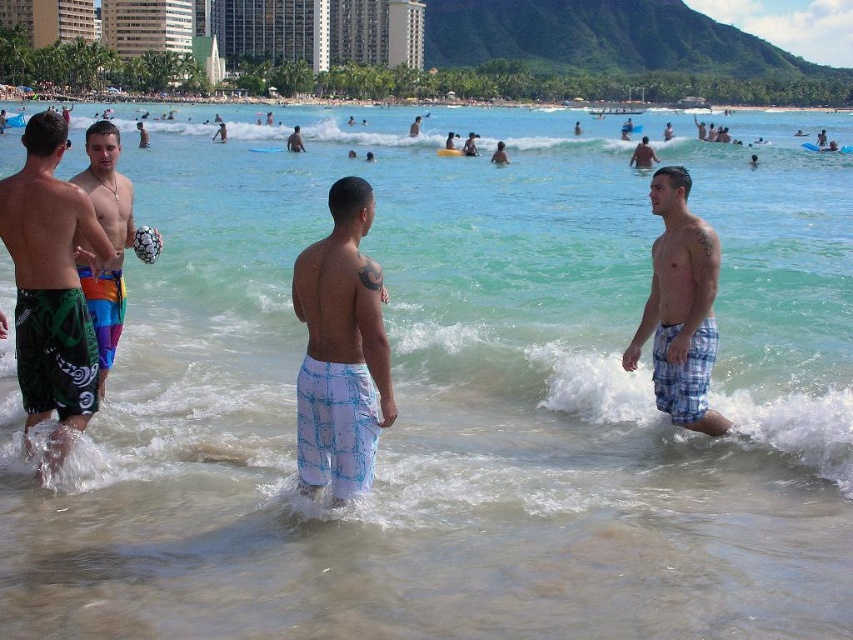
Does point (56, 156) lie in front of point (293, 148)?

Yes.

Is point (84, 300) more distant than point (303, 148)?

No.

Between point (64, 132) and point (300, 138), which one is positioned in front?

Point (64, 132) is more forward.

I want to click on green patterned shorts at left, so click(x=51, y=285).

Who is more forward, (7, 177) or (120, 259)?

Point (7, 177) is in front.

Which of these two, green patterned shorts at left or rainbow swim trunks at left, stands taller?

green patterned shorts at left

Which is behind, point (74, 374) or point (93, 301)?

Point (93, 301)

What are the coordinates of `green patterned shorts at left` in the screenshot? It's located at (51, 285).

Is plaid shorts at right wider than smooth skin body at center?

No.

In order to click on plaid shorts at right in this screenshot , I will do `click(680, 307)`.